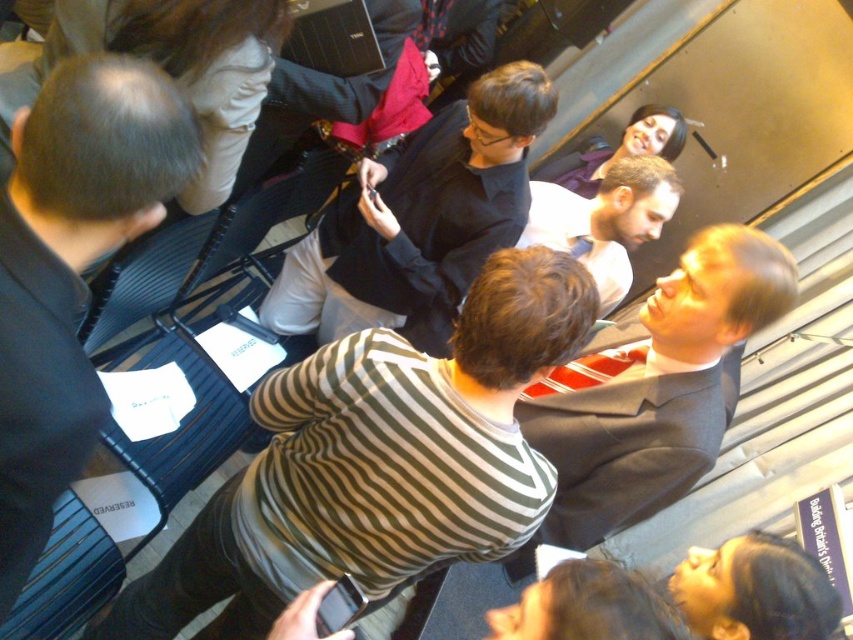
You are attending a conference and need to locate the speaker who is standing in front of another attendee. Which attendee are you closer to, the black shirt at left or the black glossy shirt at center?

You are closer to the black shirt at left because it is in front of the black glossy shirt at center, meaning the black glossy shirt at center is behind the black shirt at left.

You are organizing a photo shoot in this conference room and need to ensure that both the black glossy shirt at center and the dark gray suit at center fit within a single frame. Based on their sizes, which object should be placed closer to the camera to maintain visibility of both?

The black glossy shirt at center has a larger width than the dark gray suit at center. To ensure both fit in the frame, the black glossy shirt at center should be placed closer to the camera, as its larger size requires more space, while the dark gray suit at center can be positioned slightly farther back to balance the composition.

You are organizing a photo shoot in this conference room and need to ensure that two subjects wearing the black glossy shirt at center and dark gray suit at center are positioned exactly 24 inches apart for proper lighting. Based on their current positions, do they need to move closer or farther apart to achieve the required distance?

The black glossy shirt at center is currently 20.79 inches from the dark gray suit at center. To reach the required 24 inches, they need to move farther apart by approximately 3.21 inches.